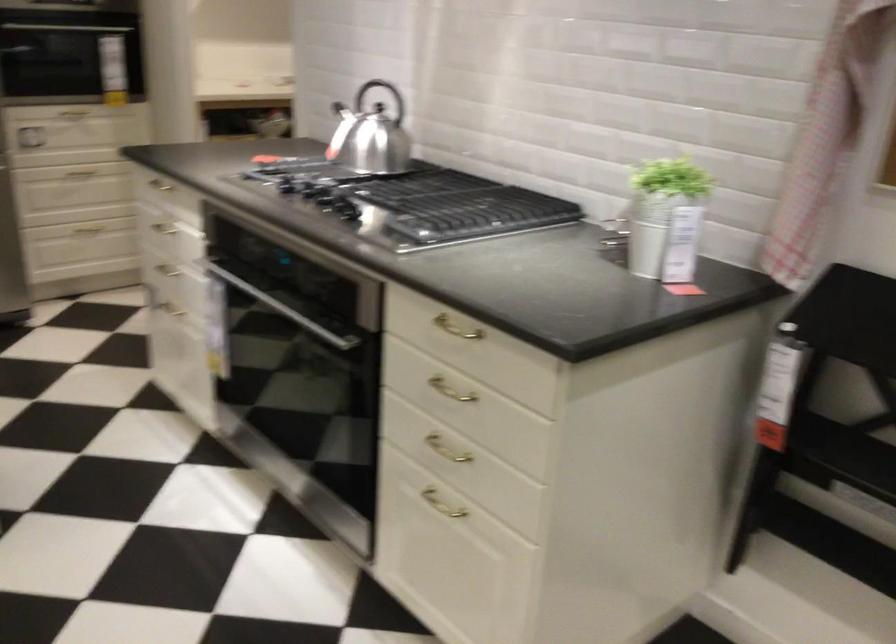
Find where to lift the white plant pot. Please return your answer as a coordinate pair (x, y).

(666, 219)